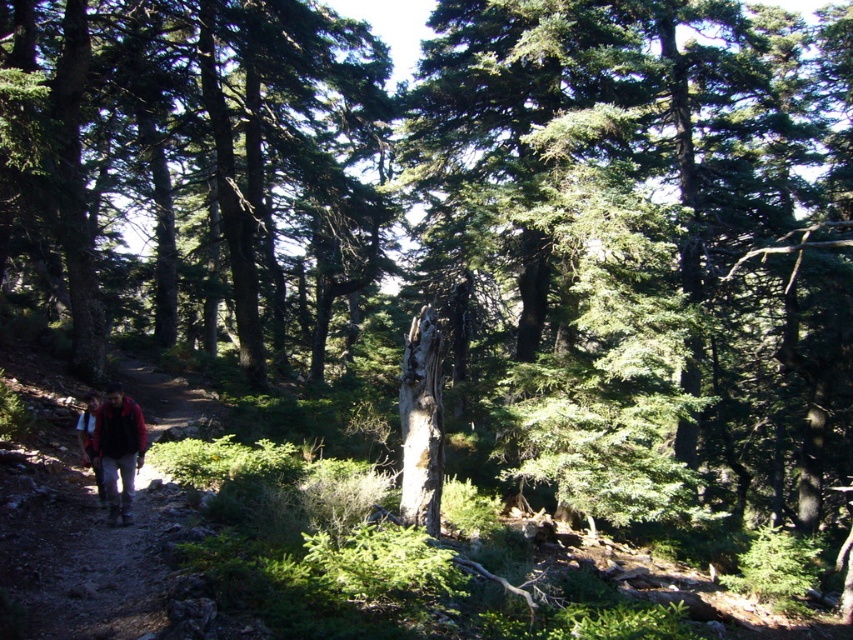
Question: Is dirt path at lower left to the right of red jacket at left from the viewer's perspective?

Choices:
 (A) no
 (B) yes

Answer: (A)

Question: Is green rough bark tree at center bigger than red plaid shirt at lower left?

Choices:
 (A) no
 (B) yes

Answer: (B)

Question: Which point is closer to the camera?

Choices:
 (A) green rough bark tree at center
 (B) red plaid shirt at lower left
 (C) dirt path at lower left

Answer: (C)

Question: Among these objects, which one is nearest to the camera?

Choices:
 (A) green rough bark tree at center
 (B) red plaid shirt at lower left
 (C) dirt path at lower left
 (D) red jacket at left

Answer: (C)

Question: Does green rough bark tree at center lie behind red jacket at left?

Choices:
 (A) yes
 (B) no

Answer: (A)

Question: Estimate the real-world distances between objects in this image. Which object is closer to the green rough bark tree at center?

Choices:
 (A) dirt path at lower left
 (B) red plaid shirt at lower left

Answer: (A)